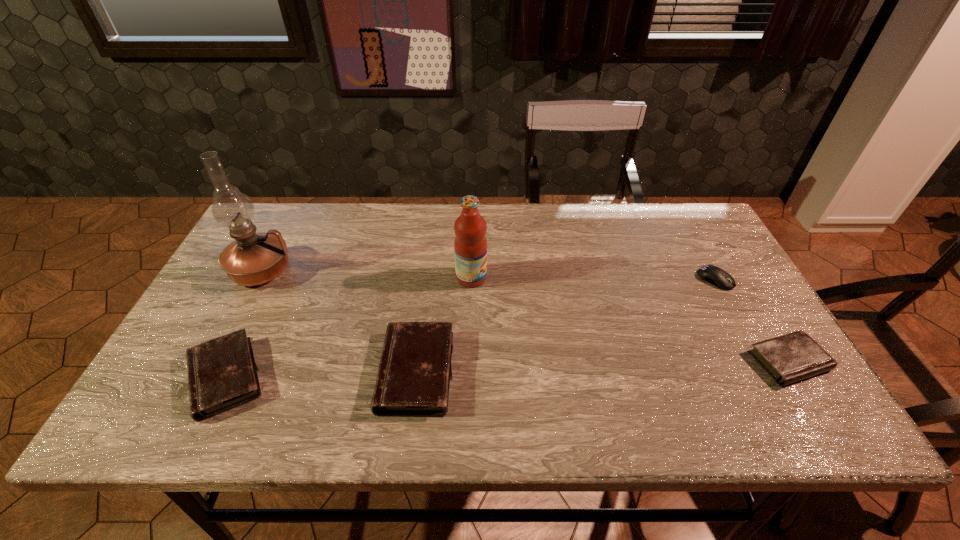
You are a GUI agent. You are given a task and a screenshot of the screen. Output one action in this format:
    pyautogui.click(x=<x>, y=<y>)
    Task: Click on the free space located on the left of the shortest diary
    The height and width of the screenshot is (540, 960).
    Given the screenshot: What is the action you would take?
    (581, 361)

Find the location of a particular element. This screenshot has height=540, width=960. vacant position located 0.380m on the front label of the fifth shortest object is located at coordinates (622, 278).

The width and height of the screenshot is (960, 540). I want to click on free spot located on the right of the tallest object, so click(335, 271).

Identify the location of free space located 0.320m on the left of the computer equipment. click(x=585, y=280).

This screenshot has width=960, height=540. In order to click on diary present at the left edge in this screenshot , I will do `click(222, 374)`.

Identify the location of oil lamp located at the left edge. (253, 259).

The image size is (960, 540). I want to click on diary at the right edge, so click(795, 356).

This screenshot has width=960, height=540. Find the location of `computer equipment that is positioned at the right edge`. computer equipment that is positioned at the right edge is located at coordinates (714, 275).

You are a GUI agent. You are given a task and a screenshot of the screen. Output one action in this format:
    pyautogui.click(x=<x>, y=<y>)
    Task: Click on the object present at the near left corner
    This screenshot has height=540, width=960.
    Given the screenshot: What is the action you would take?
    pyautogui.click(x=222, y=374)

Find the location of `object present at the near right corner`. object present at the near right corner is located at coordinates (795, 356).